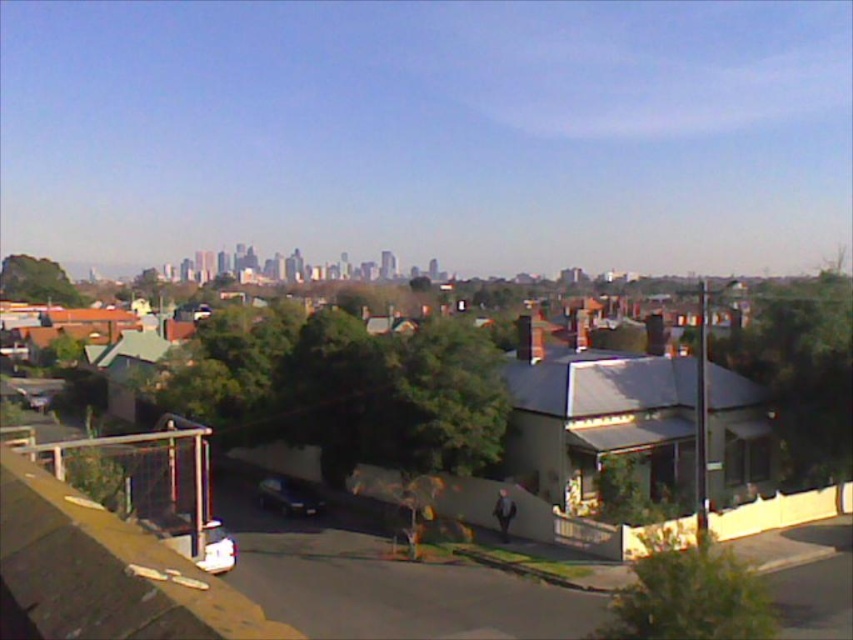
You are standing at the origin point of the image. Where is the shiny black car at lower center located in terms of coordinates?

The shiny black car at lower center is located at coordinates point (289, 497).

You are standing at the metal fence on the left side of the image. You see two points marked on the road, point (281, 508) and point (33, 406). Which point is closer to you?

Point (281, 508) is closer to the viewer than point (33, 406), so the point closer to you is point (281, 508).

You are a pedestrian standing at the sidewalk near the house. You want to cross the street to reach the metal fence on the left. There are two cars in your path. Which car, the white matte car at lower center or the shiny black car at lower left, is closer to you as you prepare to cross?

The white matte car at lower center is closer to you because it is in front of the shiny black car at lower left, meaning it is nearer to your position on the sidewalk.